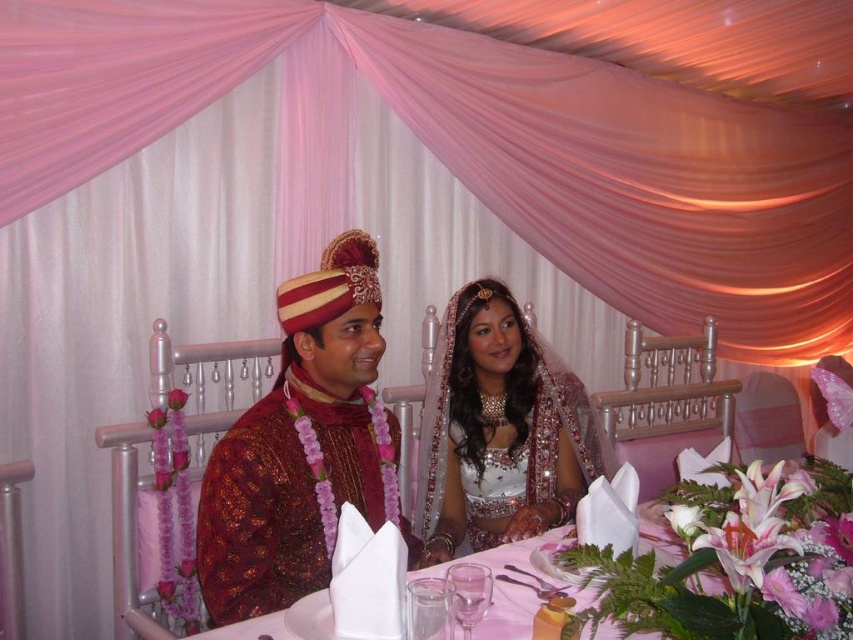
Where is the shiny silk turban at center located in the image?

The shiny silk turban at center is located at the coordinates point [303,448].

You are a photographer at the wedding and want to capture the shiny silk turban at center and the satin white blouse at center in a single frame. Which object should you focus on first to ensure both are in the shot?

The shiny silk turban at center is in front of the satin white blouse at center, so you should focus on the shiny silk turban at center first to ensure both are in the shot.